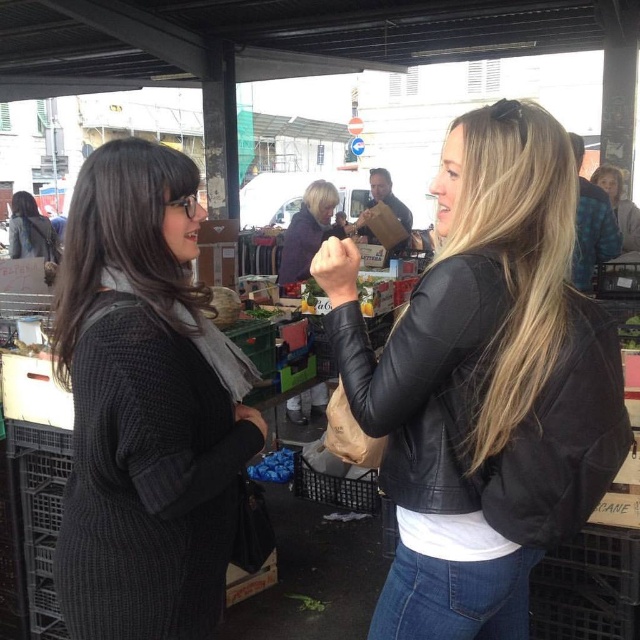
You are standing at the center of the market and looking towards the right side. Which object from the following list is located at the coordinates point 0.600, 0.756? The options are black leather jacket at right, blue jeans, and brown paper bag in left.

The black leather jacket at right is located at the coordinates point (483, 384).

You are a fashion designer observing the two women at the market. You need to determine which clothing item requires more fabric to produce between the black leather jacket at right and the dark gray knitted sweater at left. Which one would need more fabric?

The black leather jacket at right requires more fabric than the dark gray knitted sweater at left because it is bigger in size.

You are a photographer standing at the camera position. You want to take a closeup shot of the black leather jacket at right without moving the camera. Is it possible to do so with a standard zoom lens that has a maximum zoom of 200mm?

The black leather jacket at right is 38.04 inches away from the camera. With a standard zoom lens up to 200mm, it is possible to capture a closeup of the black leather jacket at right without moving the camera because the distance is within the effective range of the lens.